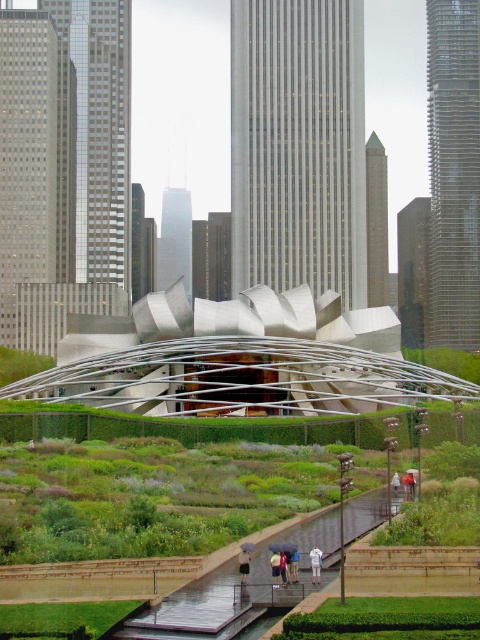
You are standing 50 meters away from the white cotton umbrella at center. If you walk straight towards it, will you reach it before the umbrella moves closer than 5 meters from you?

The white cotton umbrella at center is currently 55.44 meters away. Walking towards it, you will reduce the distance. Once you cover the 50 meters, you will be 5.44 meters away from the umbrella. Since the question asks if you reach it before the umbrella moves closer than 5 meters, the answer is no. You will be 5.44 meters away after walking 50 meters, which is still more than 5 meters. Thus, you haven not reached it yet, and the umbrella hasn not come closer than 5 meters during your walk.

You are standing at the camera position looking at the modern urban landscape. There is a point marked at coordinates point (228, 131). Can you estimate how far this point is from your current position?

The point (228, 131) is 1191.25 feet away from the camera position.

You are standing at the entrance of the garden and see the white cotton umbrella at center and the white cotton shirt at center. Which object is shorter?

The white cotton umbrella at center is not as tall as the white cotton shirt at center, so the umbrella is shorter.